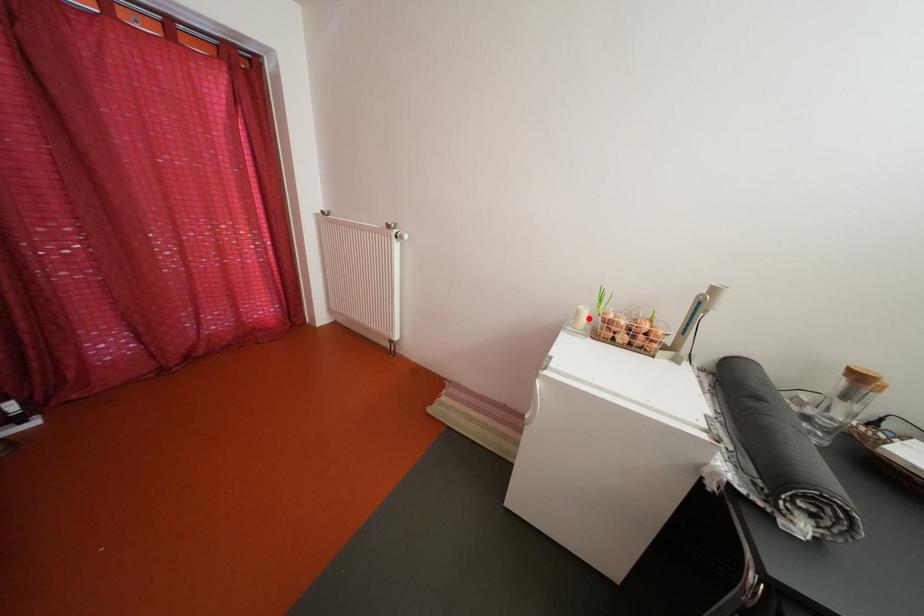
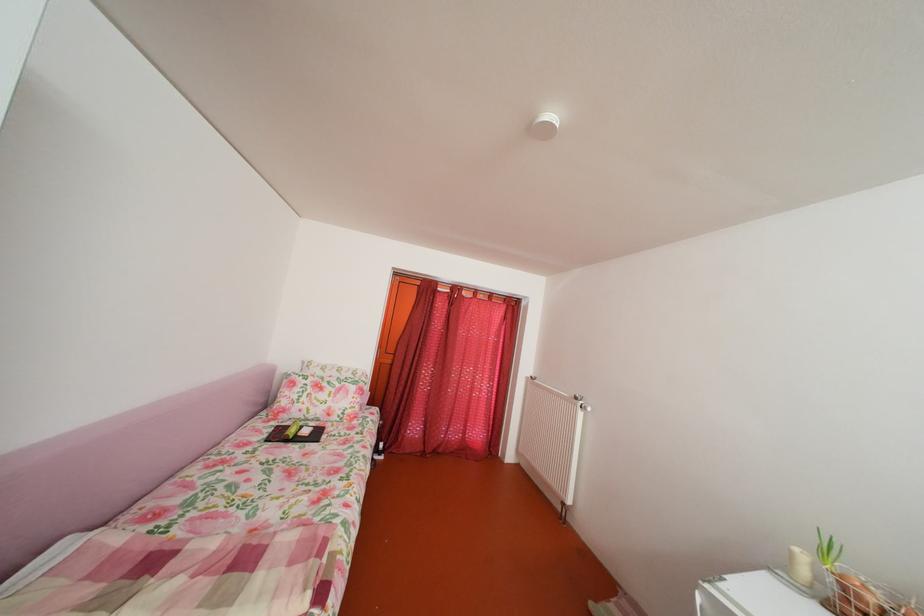
In the second image, find the point that corresponds to the highlighted location in the first image.

(803, 561)